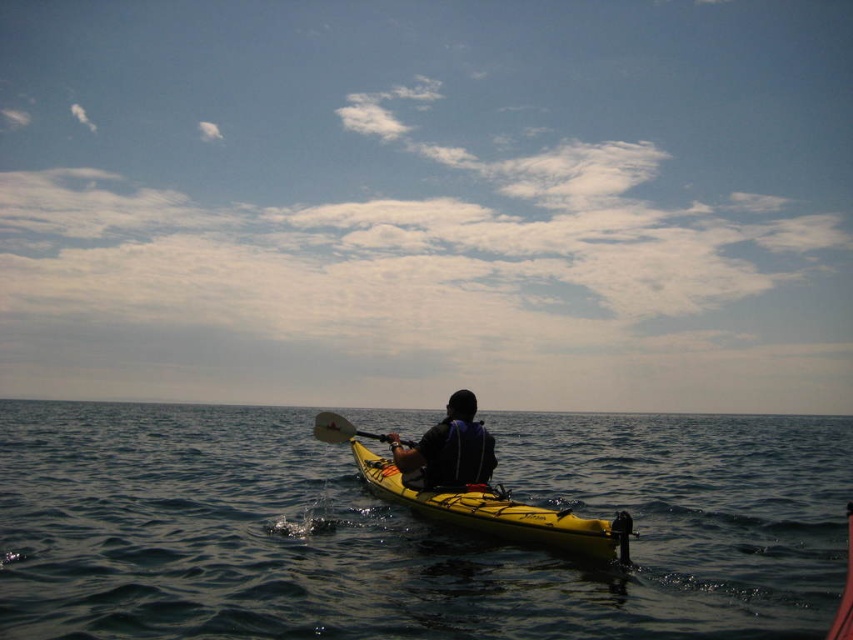
You are standing at the point labeled as point (439, 506) and want to know how far you are from the viewer. Can you determine the distance?

The distance between point (439, 506) and the viewer is 10.27 meters.

You are a photographer trying to capture the kayaker in the yellow kayak. The kayaker is currently at point (409, 529), which is dark blue water at center. Where should you position yourself to ensure the kayaker remains in the center of your photo?

The point (409, 529) indicates the dark blue water at center, so you should position yourself directly facing the dark blue water at center to keep the kayaker centered in your photo.